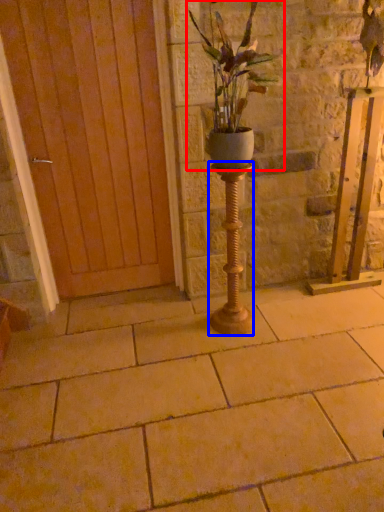
Question: Which object is closer to the camera taking this photo, houseplant (highlighted by a red box) or candle holder (highlighted by a blue box)?

Choices:
 (A) houseplant
 (B) candle holder

Answer: (A)